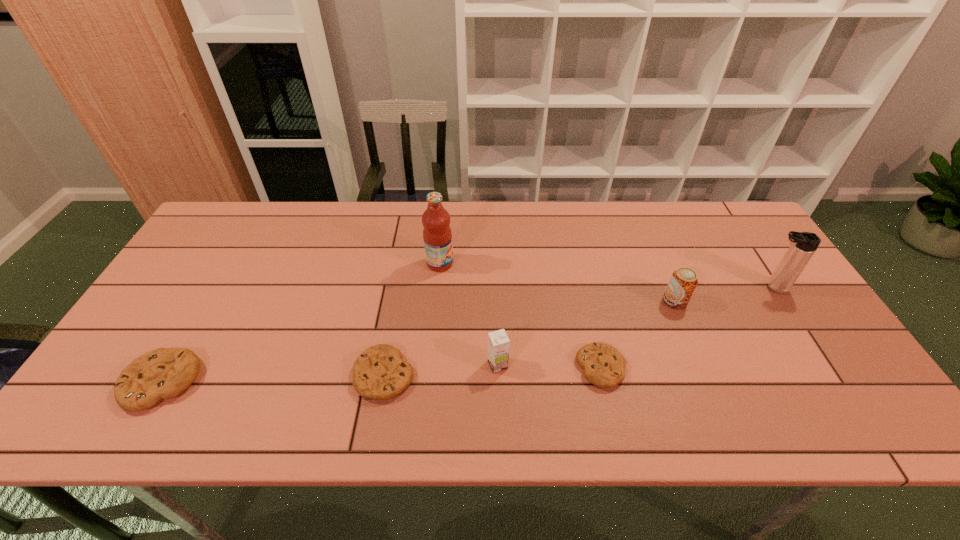
Observe the arrangement of all cookies in the image. To keep them evenly spaced, where would you place another cookie on the right? Please locate a free space. Please provide its 2D coordinates. Your answer should be formatted as a tuple, i.e. [(x, y)], where the tuple contains the x and y coordinates of a point satisfying the conditions above.

[(811, 361)]